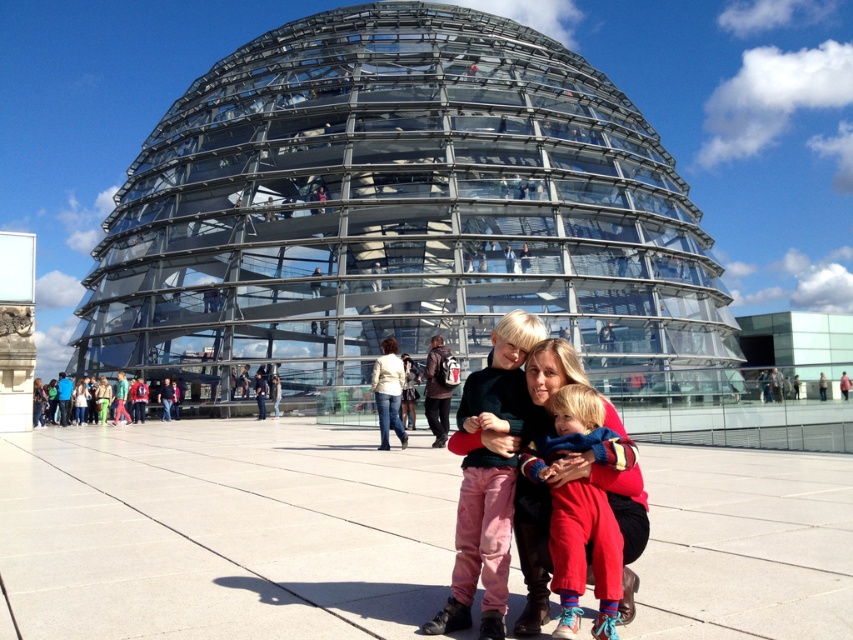
You are a photographer trying to capture the Reichstag dome in Berlin. You notice a woman in a red outfit kneeling with two children. One child wears a blue sweater with colorful stripes and red pants, while the other wears a dark green sweater at center. Which child is positioned closer to the center of the scene?

The dark green sweater at center is located at point (489, 476), which is closer to the center coordinates of the scene, so the child in the dark green sweater at center is positioned closer to the center of the scene.

You are a photographer taking a picture of the Reichstag dome. You notice two people in the foreground wearing a dark green sweater at center and a denim jacket at center. Which clothing item is positioned to the right of the other?

The dark green sweater at center is positioned to the right of the denim jacket at center.

You are a photographer trying to capture the Reichstag dome in Berlin. You notice a woman and two children in front of the dome. The woman is wearing a red outfit and has a dark green sweater at center and a knitted wool scarf at center. Which clothing item is closer to the camera?

The dark green sweater at center is in front of the knitted wool scarf at center, so the dark green sweater at center is closer to the camera.